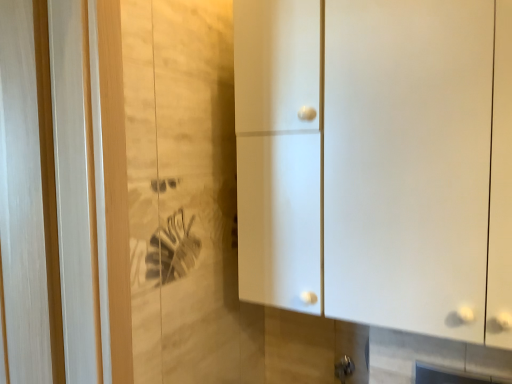
This screenshot has height=384, width=512. What do you see at coordinates (377, 161) in the screenshot?
I see `white matte cabinet at center` at bounding box center [377, 161].

Find the location of a particular element. The image size is (512, 384). white matte cabinet at center is located at coordinates (377, 161).

Measure the distance between white matte cabinet at center and camera.

white matte cabinet at center is 31.91 inches from camera.

What are the coordinates of `white matte cabinet at center` in the screenshot? It's located at (377, 161).